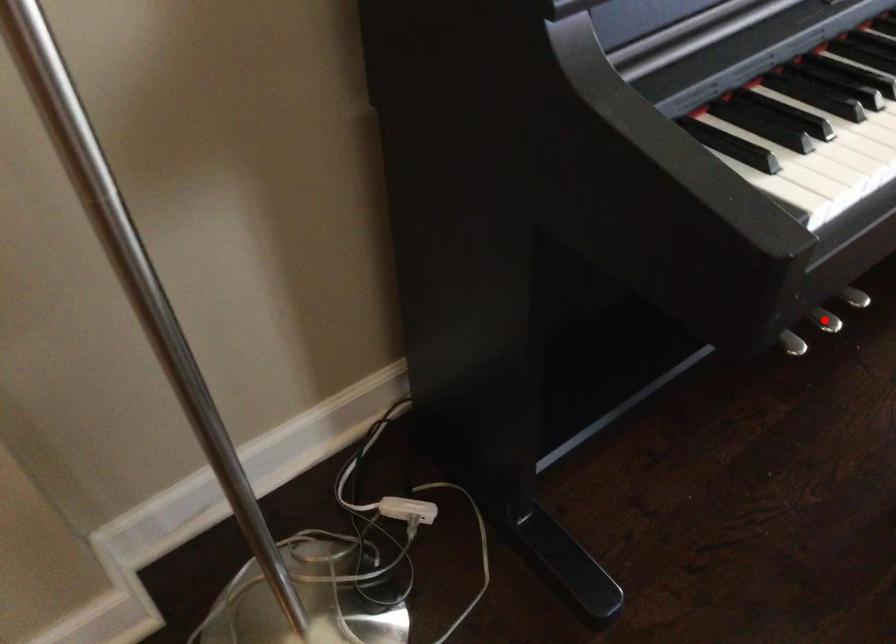
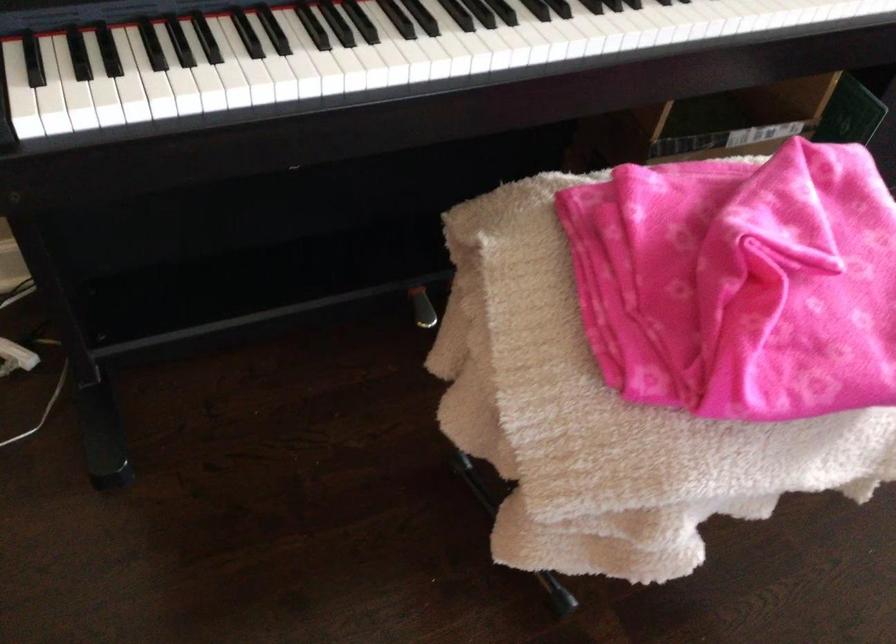
Question: I am providing you with two images of the same scene from different viewpoints. A red point is marked on the first image. Can you still see the location of the red point in image 2?

Choices:
 (A) Yes
 (B) No

Answer: (B)